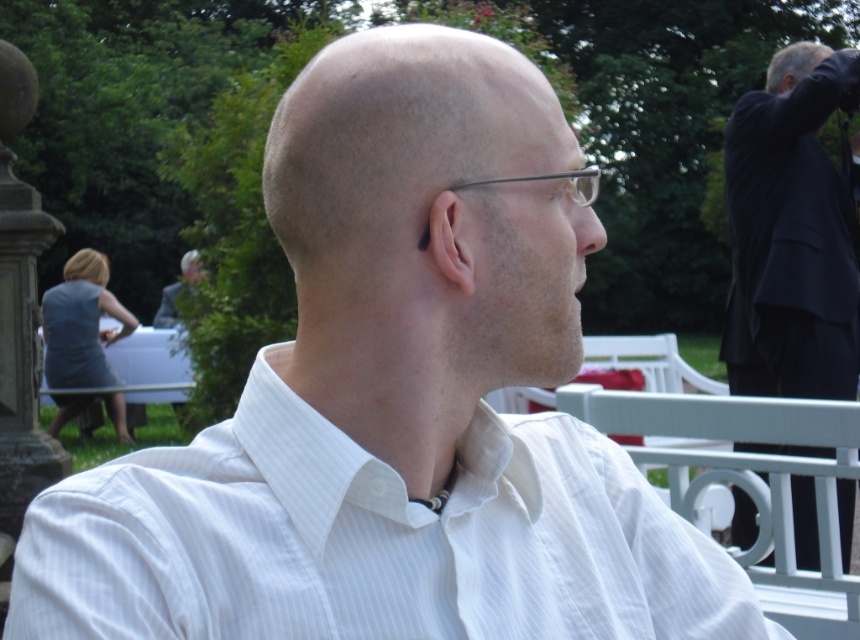
You are a photographer trying to capture a wide shot of the scene. You need to ensure that both the dark suit at upper right and the gray suit at upper left are fully visible in the frame. Given their sizes, which suit might require you to adjust your camera angle to avoid cropping?

The dark suit at upper right has a lesser width compared to the gray suit at upper left. Since it is smaller, it might be more challenging to ensure it is fully visible, so adjusting the camera angle could help capture both suits without cropping.

You are a photographer trying to capture a candid shot of the man in the white striped dress shirt at center and the person in the gray suit at upper left. Since you want both subjects to be clearly visible in the frame, which subject should you focus on first to ensure proper focus, considering their sizes?

The white striped dress shirt at center is smaller than the gray suit at upper left. Therefore, you should focus on the gray suit at upper left first because it is larger and will be easier to lock focus on before adjusting for the smaller white striped dress shirt at center.

You are a photographer setting up a shot of the man in the white striped dress shirt at center and the person in the gray suit at upper left. You want to ensure both subjects are in focus. The camera you are using has a depth of field that can cover 10 meters. Will both subjects be in focus?

The white striped dress shirt at center and gray suit at upper left are 9.98 meters apart from each other. Since the distance between them is within the camera s 10 meter depth of field, both subjects will be in focus.